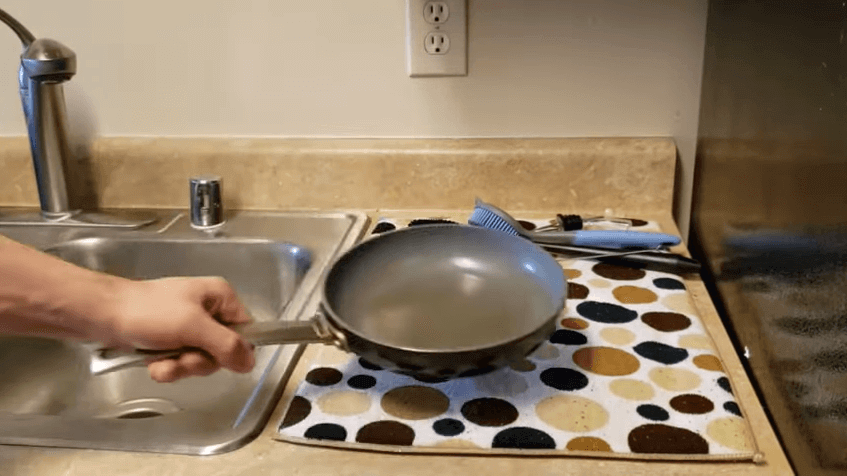
Identify the location of frying pan. (471, 301).